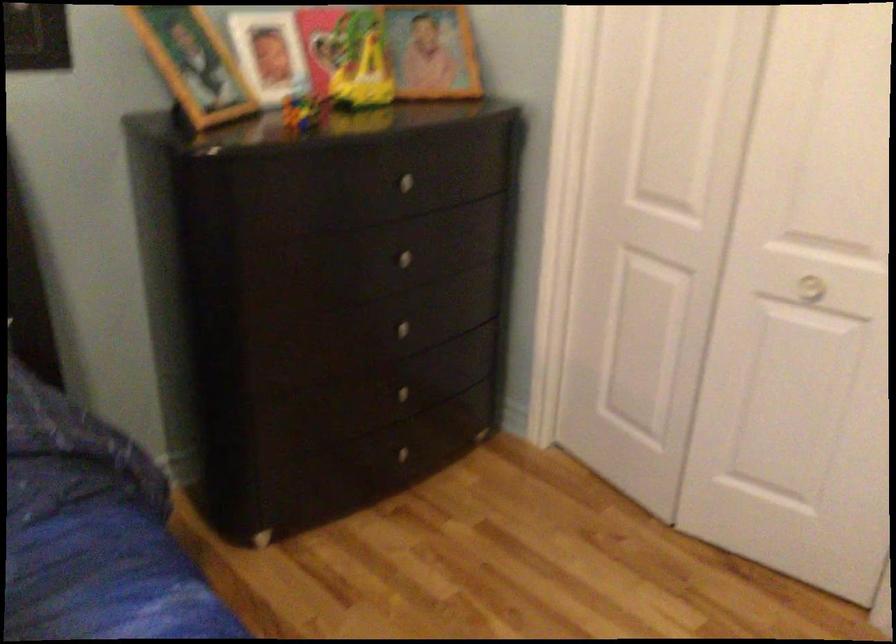
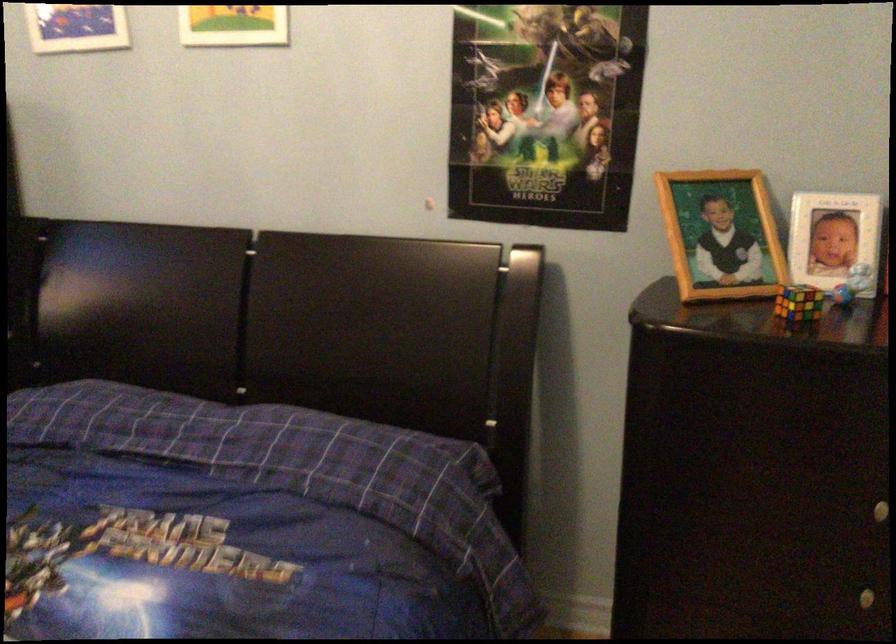
Find the pixel in the second image that matches [300,90] in the first image.

(851, 283)